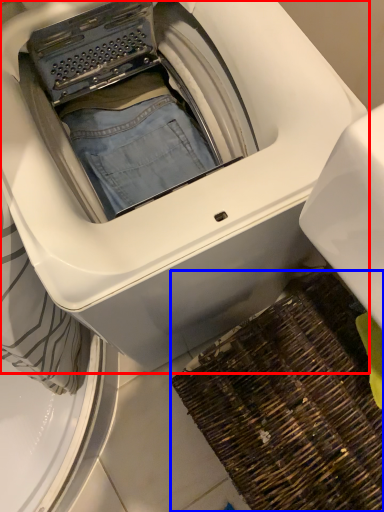
Question: Which object appears farthest to the camera in this image, washing machine (highlighted by a red box) or doormat (highlighted by a blue box)?

Choices:
 (A) washing machine
 (B) doormat

Answer: (B)